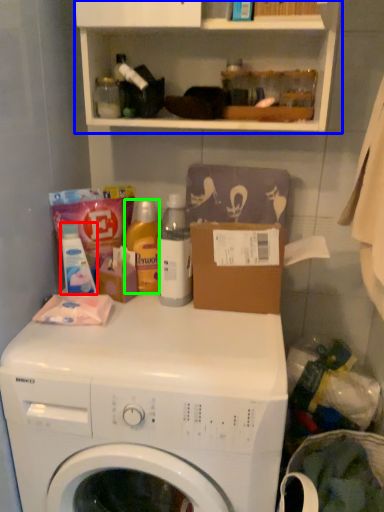
Question: Based on their relative distances, which object is farther from toiletry (highlighted by a red box)? Choose from cabinet (highlighted by a blue box) and cleaning product (highlighted by a green box).

Choices:
 (A) cabinet
 (B) cleaning product

Answer: (A)